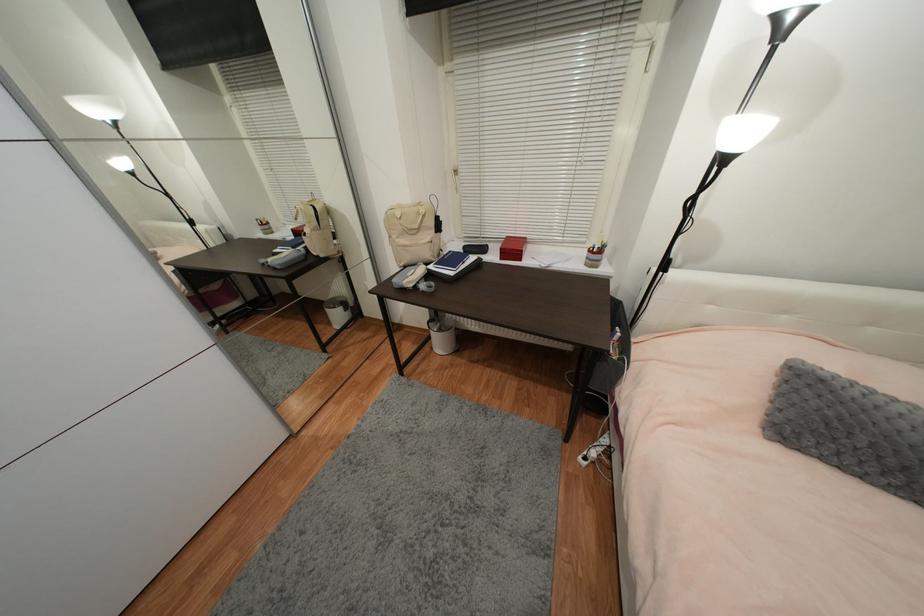
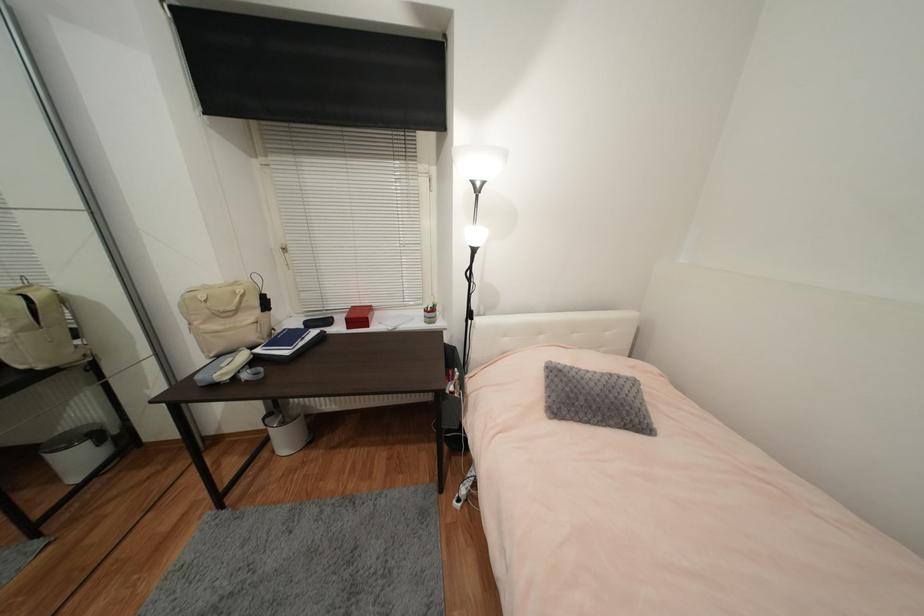
In the second image, find the point that corresponds to point 671,272 in the first image.

(477, 320)